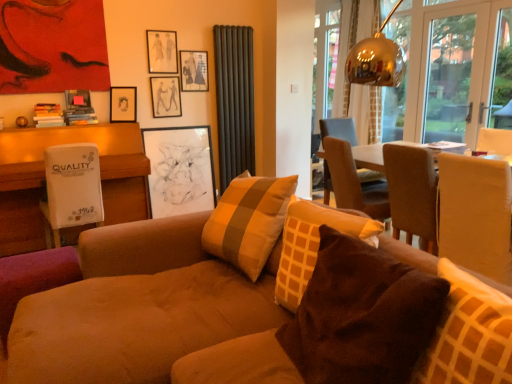
Question: From the image's perspective, is dark grey ribbed curtain at upper center, marked as the second curtain in a right-to-left arrangement, located beneath white cardboard box at left?

Choices:
 (A) yes
 (B) no

Answer: (B)

Question: Is dark grey ribbed curtain at upper center, which is the first curtain from left to right, bigger than white cardboard box at left?

Choices:
 (A) no
 (B) yes

Answer: (A)

Question: Is dark grey ribbed curtain at upper center, which is the first curtain from left to right, not near white cardboard box at left?

Choices:
 (A) yes
 (B) no

Answer: (A)

Question: Would you say white cardboard box at left is part of dark grey ribbed curtain at upper center, the first curtain in the front-to-back sequence,'s contents?

Choices:
 (A) yes
 (B) no

Answer: (B)

Question: From the image's perspective, is dark grey ribbed curtain at upper center, marked as the second curtain in a right-to-left arrangement, on white cardboard box at left?

Choices:
 (A) no
 (B) yes

Answer: (B)

Question: Based on their sizes in the image, would you say transparent glass door at upper right is bigger or smaller than matte brown chair at right, the 1th chair viewed from the front?

Choices:
 (A) big
 (B) small

Answer: (B)

Question: In the image, is transparent glass door at upper right on the left side or the right side of matte brown chair at right, the 1th chair viewed from the front?

Choices:
 (A) left
 (B) right

Answer: (B)

Question: Which is correct: transparent glass door at upper right is inside matte brown chair at right, the 2th chair from the back, or outside of it?

Choices:
 (A) inside
 (B) outside

Answer: (B)

Question: In the image, is transparent glass door at upper right positioned in front of or behind matte brown chair at right, the 1th chair viewed from the front?

Choices:
 (A) behind
 (B) front

Answer: (A)

Question: From a real-world perspective, is brown fabric chair at upper right, the 2th chair when ordered from front to back, above or below matte black picture frame at upper center, which appears as the 2th picture frame when viewed from the top?

Choices:
 (A) above
 (B) below

Answer: (B)

Question: Relative to matte black picture frame at upper center, which appears as the 2th picture frame when viewed from the top, is brown fabric chair at upper right, the 2th chair when ordered from front to back, in front or behind?

Choices:
 (A) front
 (B) behind

Answer: (A)

Question: In terms of size, does brown fabric chair at upper right, the 2th chair when ordered from front to back, appear bigger or smaller than matte black picture frame at upper center, the fourth picture frame in the bottom-to-top sequence?

Choices:
 (A) small
 (B) big

Answer: (B)

Question: Is point (332, 130) positioned closer to the camera than point (198, 69)?

Choices:
 (A) closer
 (B) farther

Answer: (A)

Question: Is white cardboard box at left wider or thinner than matte black picture frame at upper center, which appears as the 2th picture frame when viewed from the top?

Choices:
 (A) wide
 (B) thin

Answer: (A)

Question: From a real-world perspective, is white cardboard box at left positioned above or below matte black picture frame at upper center, which appears as the 2th picture frame when viewed from the top?

Choices:
 (A) below
 (B) above

Answer: (A)